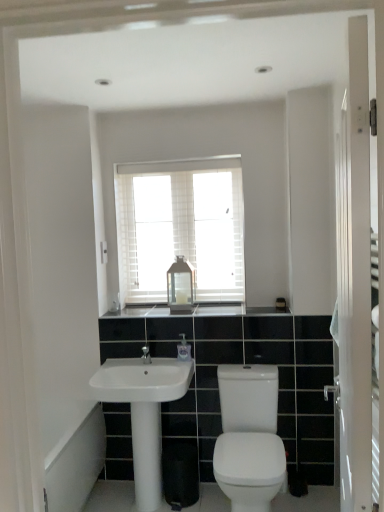
Find the location of a particular element. free space to the left of translucent plastic soap dispenser at center is located at coordinates (155, 360).